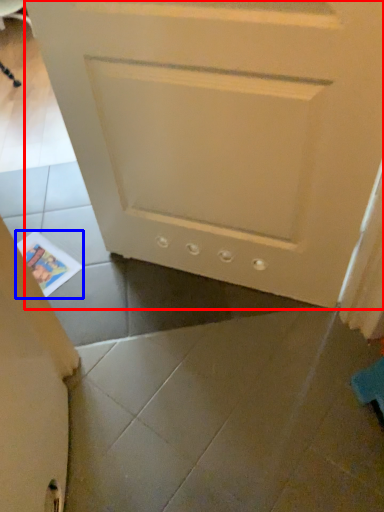
Question: Which object appears closest to the camera in this image, door (highlighted by a red box) or magazine (highlighted by a blue box)?

Choices:
 (A) door
 (B) magazine

Answer: (A)